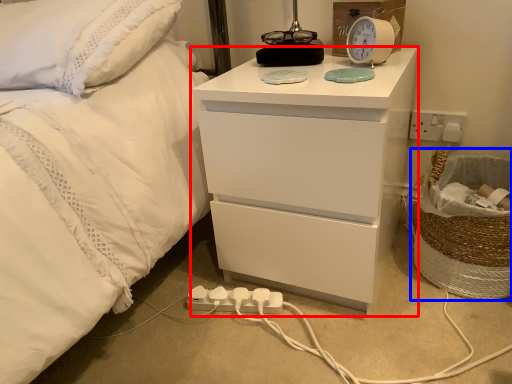
Question: Which object appears farthest to the camera in this image, chest of drawers (highlighted by a red box) or laundry basket (highlighted by a blue box)?

Choices:
 (A) chest of drawers
 (B) laundry basket

Answer: (B)